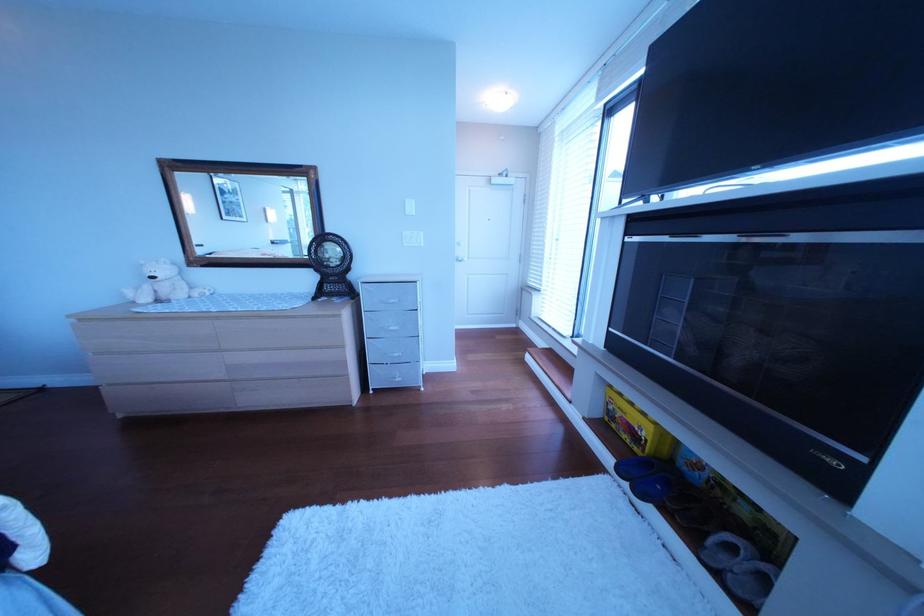
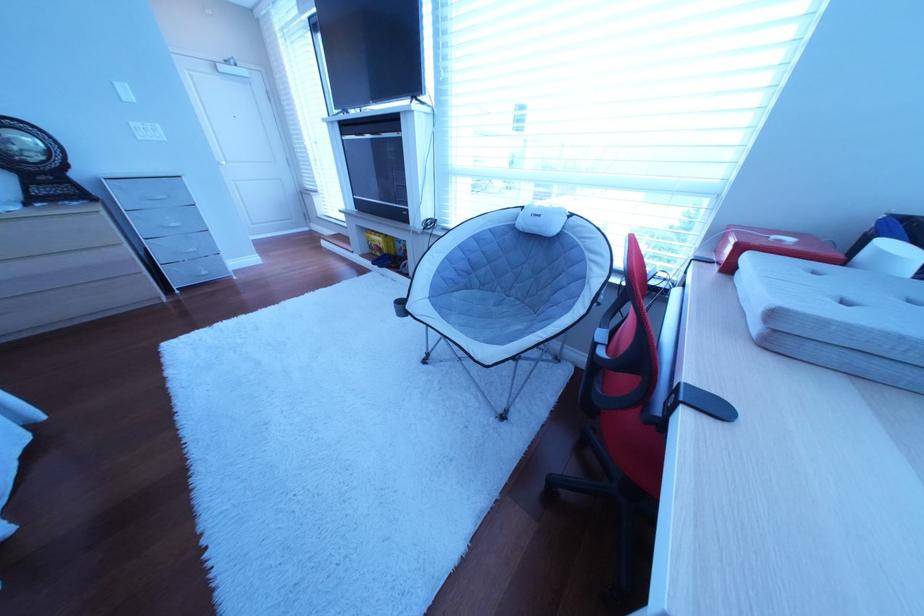
In the second image, find the point that corresponds to point 411,357 in the first image.

(207, 252)